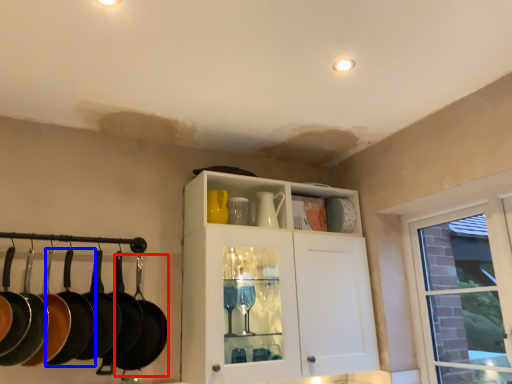
Question: Which object is closer to the camera taking this photo, frying pan (highlighted by a red box) or frying pan (highlighted by a blue box)?

Choices:
 (A) frying pan
 (B) frying pan

Answer: (B)